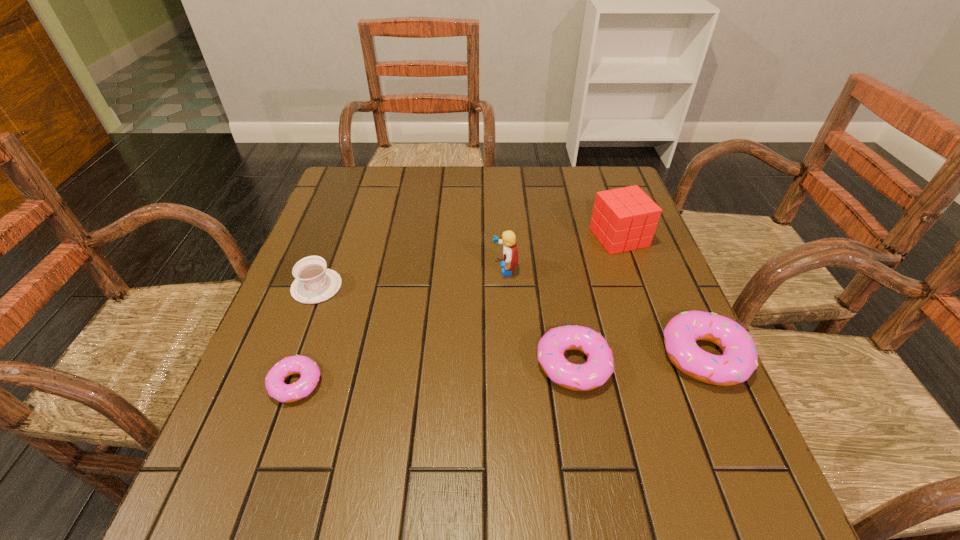
Identify the location of the shortest doughnut. Image resolution: width=960 pixels, height=540 pixels. (298, 364).

Image resolution: width=960 pixels, height=540 pixels. I want to click on the shortest object, so pos(298,364).

Locate an element on the screen. This screenshot has width=960, height=540. the second tallest doughnut is located at coordinates (597, 370).

The image size is (960, 540). Find the location of `the fourth object from left to right`. the fourth object from left to right is located at coordinates (597, 370).

At what (x,y) coordinates should I click in order to perform the action: click on the rightmost doughnut. Please return your answer as a coordinate pair (x, y). Looking at the image, I should click on (739, 360).

The height and width of the screenshot is (540, 960). What are the coordinates of `teacup` in the screenshot? It's located at (314, 283).

Where is `Lego`? The height and width of the screenshot is (540, 960). Lego is located at coordinates (510, 254).

Find the location of `the farthest object`. the farthest object is located at coordinates (623, 219).

The height and width of the screenshot is (540, 960). What are the coordinates of `vacant point located 0.240m on the back of the shortest doughnut` in the screenshot? It's located at [332, 279].

Where is `vacant space situated on the back of the second doughnut from right to left`? vacant space situated on the back of the second doughnut from right to left is located at coordinates (549, 234).